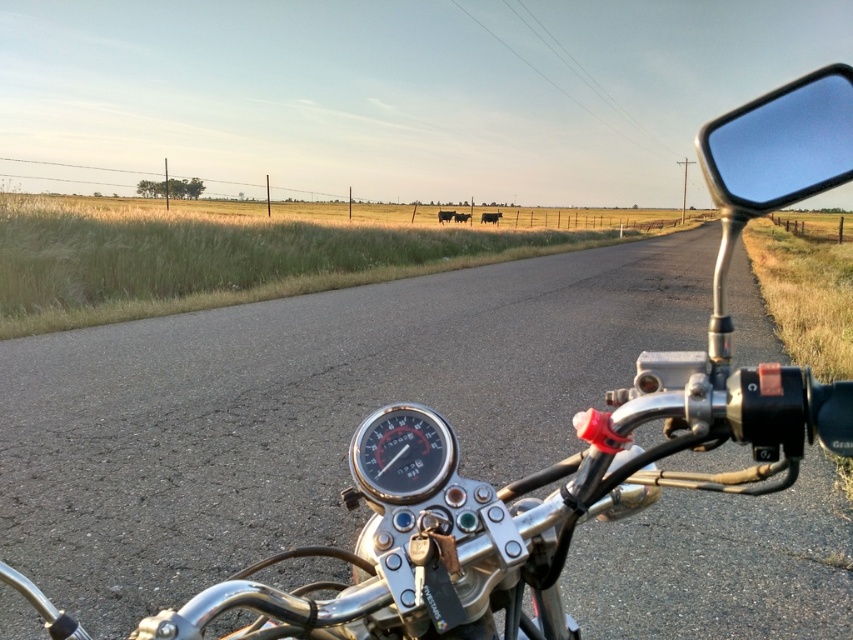
Can you confirm if green grass at left is shorter than clear glass mirror at right?

Incorrect, green grass at left's height does not fall short of clear glass mirror at right's.

Can you confirm if green grass at left is positioned above clear glass mirror at right?

Yes.

The image size is (853, 640). Describe the element at coordinates (224, 259) in the screenshot. I see `green grass at left` at that location.

At what (x,y) coordinates should I click in order to perform the action: click on green grass at left. Please return your answer as a coordinate pair (x, y). This screenshot has width=853, height=640. Looking at the image, I should click on (224, 259).

Who is more forward, (x=93, y=218) or (x=381, y=436)?

Positioned in front is point (x=381, y=436).

Is green grass at left taller than black plastic speedometer at center?

Indeed, green grass at left has a greater height compared to black plastic speedometer at center.

Image resolution: width=853 pixels, height=640 pixels. Identify the location of green grass at left. (224, 259).

Does clear glass mirror at right have a smaller size compared to black plastic speedometer at center?

Actually, clear glass mirror at right might be larger than black plastic speedometer at center.

Measure the distance between clear glass mirror at right and camera.

The distance of clear glass mirror at right from camera is 97.41 centimeters.

Locate an element on the screen. This screenshot has width=853, height=640. clear glass mirror at right is located at coordinates (780, 145).